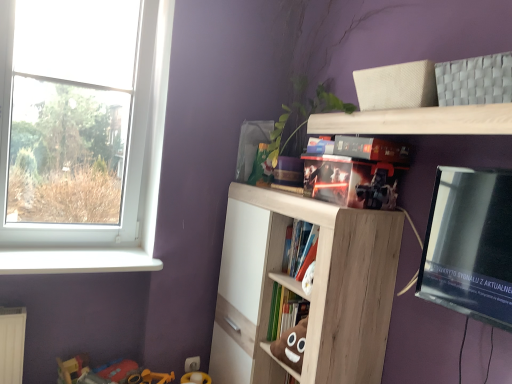
Question: From the image's perspective, is light wood shelf at upper center, which is the second shelf from top to bottom, above hardcover book at center, which is counted as the second book, starting from the bottom?

Choices:
 (A) yes
 (B) no

Answer: (B)

Question: Can you confirm if light wood shelf at upper center, which is the second shelf from top to bottom, is taller than hardcover book at center, which is counted as the second book, starting from the bottom?

Choices:
 (A) no
 (B) yes

Answer: (B)

Question: Is the depth of light wood shelf at upper center, which is the second shelf from top to bottom, greater than that of hardcover book at center, which is counted as the second book, starting from the bottom?

Choices:
 (A) no
 (B) yes

Answer: (A)

Question: Is light wood shelf at upper center, which is the 1th shelf in bottom-to-top order, outside of hardcover book at center, the second book positioned from the top?

Choices:
 (A) yes
 (B) no

Answer: (A)

Question: Can you confirm if light wood shelf at upper center, which is the second shelf from top to bottom, is positioned to the right of hardcover book at center, the second book positioned from the top?

Choices:
 (A) yes
 (B) no

Answer: (B)

Question: Is light wood shelf at upper center, which is the second shelf from top to bottom, at the left side of hardcover book at center, the second book positioned from the top?

Choices:
 (A) no
 (B) yes

Answer: (B)

Question: Does light wood shelf at upper center, which is the 1th shelf in bottom-to-top order, have a greater height compared to matt cardboard box at upper center, marked as the 3th book in a bottom-to-top arrangement?

Choices:
 (A) no
 (B) yes

Answer: (B)

Question: Is light wood shelf at upper center, which is the second shelf from top to bottom, to the left of matt cardboard box at upper center, marked as the 3th book in a bottom-to-top arrangement, from the viewer's perspective?

Choices:
 (A) yes
 (B) no

Answer: (A)

Question: Are light wood shelf at upper center, which is the second shelf from top to bottom, and matt cardboard box at upper center, acting as the first book starting from the top, located far from each other?

Choices:
 (A) no
 (B) yes

Answer: (A)

Question: From a real-world perspective, is light wood shelf at upper center, which is the second shelf from top to bottom, located higher than matt cardboard box at upper center, marked as the 3th book in a bottom-to-top arrangement?

Choices:
 (A) yes
 (B) no

Answer: (B)

Question: Is the position of light wood shelf at upper center, which is the 1th shelf in bottom-to-top order, more distant than that of matt cardboard box at upper center, marked as the 3th book in a bottom-to-top arrangement?

Choices:
 (A) no
 (B) yes

Answer: (B)

Question: Is light wood shelf at upper center, which is the 1th shelf in bottom-to-top order, touching matt cardboard box at upper center, acting as the first book starting from the top?

Choices:
 (A) yes
 (B) no

Answer: (B)

Question: From the image's perspective, does white plastic window sill at lower left appear lower than plastic toy at lower left?

Choices:
 (A) yes
 (B) no

Answer: (B)